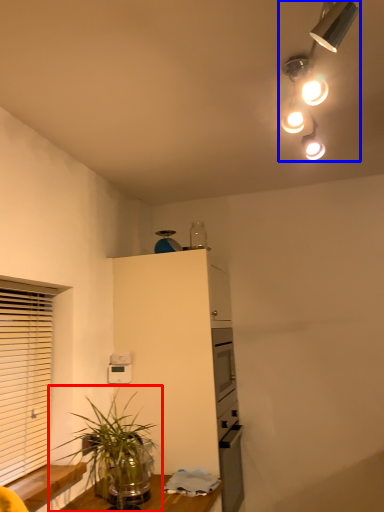
Question: Which object is further to the camera taking this photo, houseplant (highlighted by a red box) or lamp (highlighted by a blue box)?

Choices:
 (A) houseplant
 (B) lamp

Answer: (A)